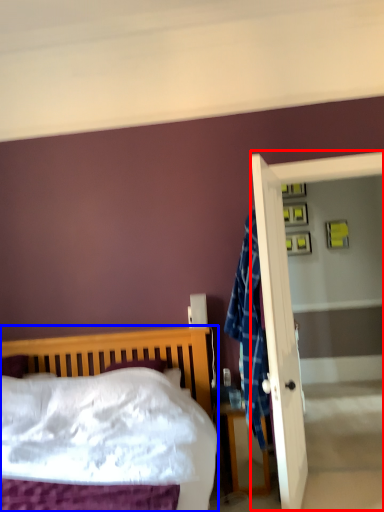
Question: Which of the following is the closest to the observer, screen door (highlighted by a red box) or bed (highlighted by a blue box)?

Choices:
 (A) screen door
 (B) bed

Answer: (B)